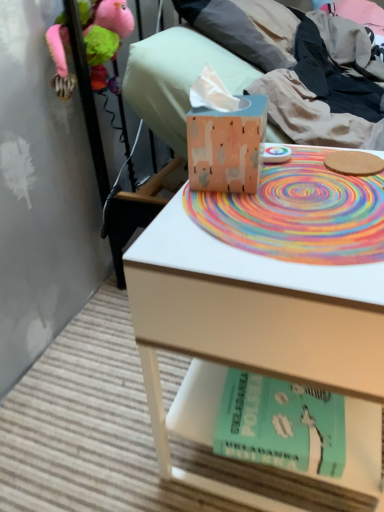
The height and width of the screenshot is (512, 384). What do you see at coordinates (103, 34) in the screenshot? I see `soft pink plush toy at upper left` at bounding box center [103, 34].

This screenshot has height=512, width=384. What do you see at coordinates (281, 424) in the screenshot?
I see `teal matte paperback book at lower center` at bounding box center [281, 424].

This screenshot has height=512, width=384. In order to click on matte cardboard tissue box at upper center in this screenshot , I will do `click(239, 75)`.

Considering the positions of points (252, 419) and (218, 259), is point (252, 419) closer to camera compared to point (218, 259)?

No.

Could you tell me if teal matte paperback book at lower center is facing wooden table at center?

Yes, teal matte paperback book at lower center is turned towards wooden table at center.

From the image's perspective, is teal matte paperback book at lower center above or below wooden table at center?

From the image's perspective, teal matte paperback book at lower center appears below wooden table at center.

Is teal matte paperback book at lower center outside of wooden table at center?

No, teal matte paperback book at lower center is inside or overlapping with wooden table at center.

Considering the sizes of teal matte paperback book at lower center and wooden tissue box at center in the image, is teal matte paperback book at lower center taller or shorter than wooden tissue box at center?

In the image, teal matte paperback book at lower center appears to be shorter than wooden tissue box at center.

From a real-world perspective, is teal matte paperback book at lower center physically above wooden tissue box at center?

No.

Does teal matte paperback book at lower center appear on the left side of wooden tissue box at center?

No, teal matte paperback book at lower center is not to the left of wooden tissue box at center.

Between point (275, 384) and point (203, 179), which one is positioned in front?

Point (203, 179)

Does soft pink plush toy at upper left turn towards teal matte paperback book at lower center?

No, soft pink plush toy at upper left is not facing towards teal matte paperback book at lower center.

How different are the orientations of soft pink plush toy at upper left and teal matte paperback book at lower center in degrees?

The facing directions of soft pink plush toy at upper left and teal matte paperback book at lower center are 4.54 degrees apart.

Would you say soft pink plush toy at upper left is inside or outside teal matte paperback book at lower center?

soft pink plush toy at upper left is not inside teal matte paperback book at lower center, it's outside.

In the scene shown: Is soft pink plush toy at upper left far away from teal matte paperback book at lower center?

No, soft pink plush toy at upper left is not far away from teal matte paperback book at lower center.

Considering the positions of objects wooden tissue box at center and soft pink plush toy at upper left in the image provided, who is in front, wooden tissue box at center or soft pink plush toy at upper left?

Positioned in front is wooden tissue box at center.

Locate an element on the screen. This screenshot has width=384, height=512. tissue in front of the soft pink plush toy at upper left is located at coordinates (224, 136).

Based on the photo, can you confirm if wooden tissue box at center is wider than soft pink plush toy at upper left?

No.

Is wooden tissue box at center completely or partially outside of soft pink plush toy at upper left?

Yes, wooden tissue box at center is located beyond the bounds of soft pink plush toy at upper left.

Considering the positions of objects soft pink plush toy at upper left and rainbow spiral mat at center in the image provided, who is in front, soft pink plush toy at upper left or rainbow spiral mat at center?

rainbow spiral mat at center is more forward.

Is soft pink plush toy at upper left looking in the opposite direction of rainbow spiral mat at center?

That's not correct — soft pink plush toy at upper left is not looking away from rainbow spiral mat at center.

Measure the distance between soft pink plush toy at upper left and rainbow spiral mat at center.

The distance of soft pink plush toy at upper left from rainbow spiral mat at center is 24.74 inches.

Can you tell me how much wooden table at center and teal matte paperback book at lower center differ in facing direction?

wooden table at center and teal matte paperback book at lower center are facing 0.668 degrees away from each other.

Is wooden table at center aimed at teal matte paperback book at lower center?

No, wooden table at center is not turned towards teal matte paperback book at lower center.

Who is taller, wooden table at center or teal matte paperback book at lower center?

Standing taller between the two is wooden table at center.

Would you say wooden table at center is part of rainbow spiral mat at center's contents?

No, rainbow spiral mat at center does not contain wooden table at center.

Looking at this image, is rainbow spiral mat at center shorter than wooden table at center?

Indeed, rainbow spiral mat at center has a lesser height compared to wooden table at center.

Measure the distance between rainbow spiral mat at center and wooden table at center.

6.18 inches.

Could you tell me if rainbow spiral mat at center is turned towards wooden table at center?

Yes, rainbow spiral mat at center faces towards wooden table at center.

The width and height of the screenshot is (384, 512). I want to click on table above the teal matte paperback book at lower center (from the image's perspective), so click(245, 328).

Locate an element on the screen. The image size is (384, 512). tissue in front of the teal matte paperback book at lower center is located at coordinates (224, 136).

From the image, which object appears to be nearer to rainbow spiral mat at center, teal matte paperback book at lower center or matte cardboard tissue box at upper center?

teal matte paperback book at lower center lies closer to rainbow spiral mat at center than the other object.

From the image, which object appears to be nearer to soft pink plush toy at upper left, wooden tissue box at center or teal matte paperback book at lower center?

Based on the image, wooden tissue box at center appears to be nearer to soft pink plush toy at upper left.

Looking at the image, which one is located further to soft pink plush toy at upper left, rainbow spiral mat at center or wooden tissue box at center?

Based on the image, rainbow spiral mat at center appears to be further to soft pink plush toy at upper left.

Estimate the real-world distances between objects in this image. Which object is closer to wooden table at center, teal matte paperback book at lower center or matte cardboard tissue box at upper center?

teal matte paperback book at lower center is positioned closer to the anchor wooden table at center.

Which object lies nearer to the anchor point teal matte paperback book at lower center, matte cardboard tissue box at upper center or rainbow spiral mat at center?

rainbow spiral mat at center is closer to teal matte paperback book at lower center.

Looking at the image, which one is located closer to wooden table at center, rainbow spiral mat at center or teal matte paperback book at lower center?

Based on the image, rainbow spiral mat at center appears to be nearer to wooden table at center.

From the image, which object appears to be nearer to wooden table at center, matte cardboard tissue box at upper center or wooden tissue box at center?

wooden tissue box at center is closer to wooden table at center.

Based on their spatial positions, is soft pink plush toy at upper left or teal matte paperback book at lower center further from wooden table at center?

Among the two, soft pink plush toy at upper left is located further to wooden table at center.

Find the location of a particular element. mat that lies between soft pink plush toy at upper left and teal matte paperback book at lower center from top to bottom is located at coordinates (299, 213).

You are a GUI agent. You are given a task and a screenshot of the screen. Output one action in this format:
    pyautogui.click(x=<x>, y=<y>)
    Task: Click on the mat between wooden tissue box at center and wooden table at center from top to bottom
    This screenshot has height=512, width=384.
    Given the screenshot: What is the action you would take?
    pyautogui.click(x=299, y=213)

What are the coordinates of `table between wooden tissue box at center and teal matte paperback book at lower center in the up-down direction` in the screenshot? It's located at (245, 328).

This screenshot has width=384, height=512. Identify the location of toy between matte cardboard tissue box at upper center and rainbow spiral mat at center in the up-down direction. (103, 34).